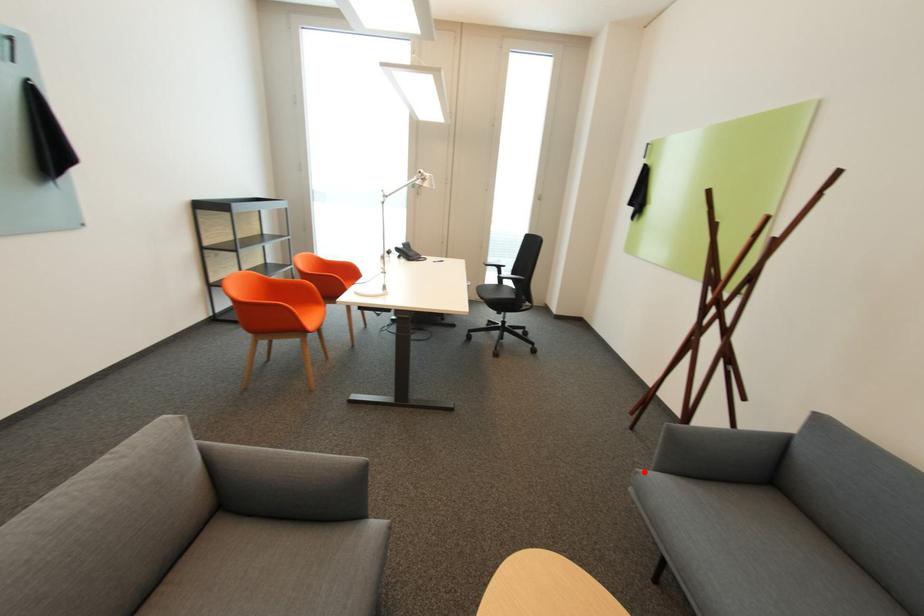
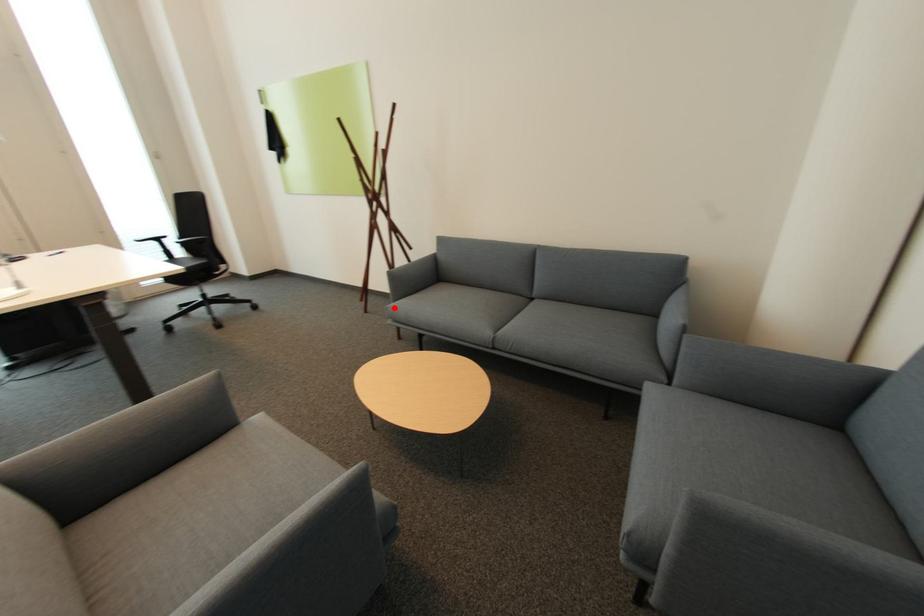
I am providing you with two images of the same scene from different viewpoints. A red point is marked on the first image and another point is marked on the second image. Does the point marked in image1 correspond to the same location as the one in image2?

Yes